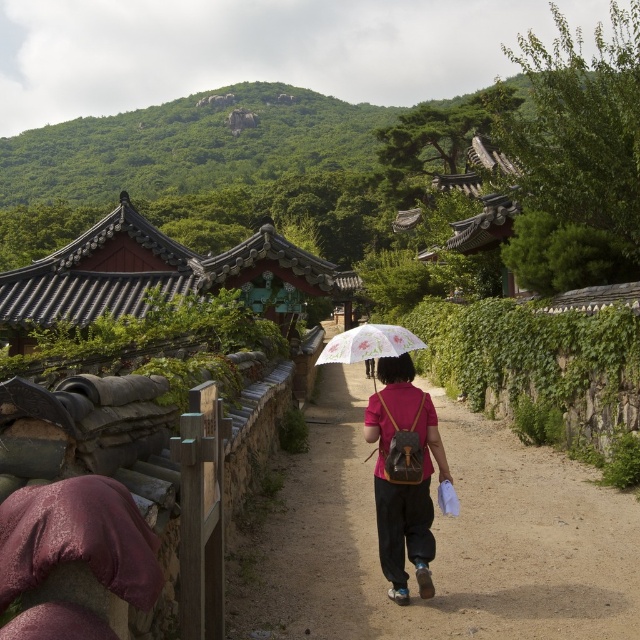
From the picture: Between matte pink shirt at center and transparent floral-patterned umbrella at center, which one is positioned lower?

matte pink shirt at center is lower down.

Does matte pink shirt at center have a lesser width compared to transparent floral-patterned umbrella at center?

Yes, matte pink shirt at center is thinner than transparent floral-patterned umbrella at center.

Does point (449, 470) come in front of point (387, 336)?

No, it is not.

Locate an element on the screen. This screenshot has width=640, height=640. matte pink shirt at center is located at coordinates (403, 476).

Between brown dirt path at center and matte pink shirt at center, which one appears on the left side from the viewer's perspective?

From the viewer's perspective, matte pink shirt at center appears more on the left side.

Is brown dirt path at center above matte pink shirt at center?

Actually, brown dirt path at center is below matte pink shirt at center.

Identify the location of brown dirt path at center. (436, 538).

Does brown dirt path at center have a greater width compared to transparent floral-patterned umbrella at center?

Indeed, brown dirt path at center has a greater width compared to transparent floral-patterned umbrella at center.

From the picture: Is brown dirt path at center to the left of transparent floral-patterned umbrella at center from the viewer's perspective?

Incorrect, brown dirt path at center is not on the left side of transparent floral-patterned umbrella at center.

Between point (289, 484) and point (408, 332), which one is positioned in front?

Point (408, 332) is in front.

The width and height of the screenshot is (640, 640). Identify the location of brown dirt path at center. (436, 538).